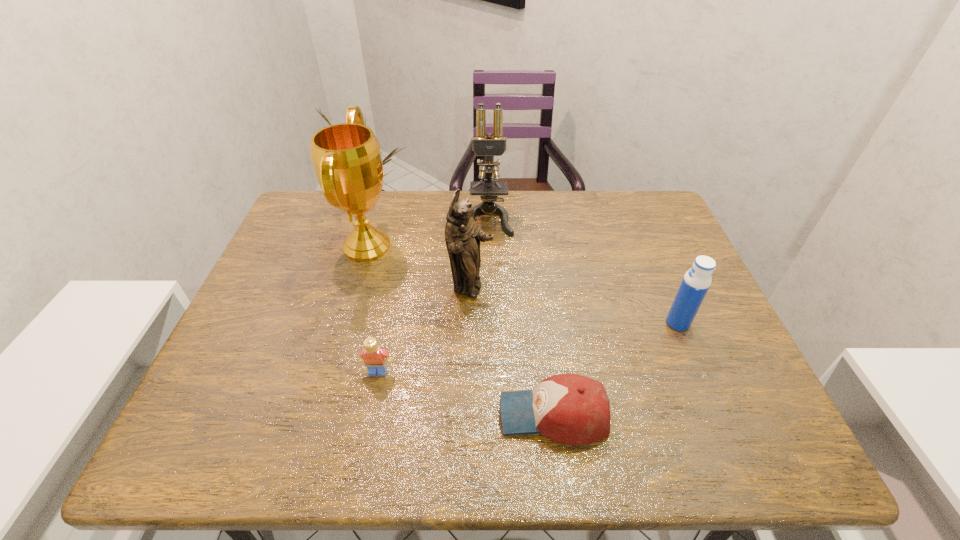
Where is `vacant area in the image that satisfies the following two spatial constraints: 1. at the eyepieces of the microscope; 2. on the front-facing side of the third tallest object`? Image resolution: width=960 pixels, height=540 pixels. vacant area in the image that satisfies the following two spatial constraints: 1. at the eyepieces of the microscope; 2. on the front-facing side of the third tallest object is located at coordinates (490, 288).

Identify the location of vacant space that satisfies the following two spatial constraints: 1. on the front-facing side of the figurine; 2. on the left side of the fourth tallest object. This screenshot has height=540, width=960. point(469,323).

Identify the location of free space in the image that satisfies the following two spatial constraints: 1. at the eyepieces of the microscope; 2. on the front-facing side of the fourth shortest object. (490, 288).